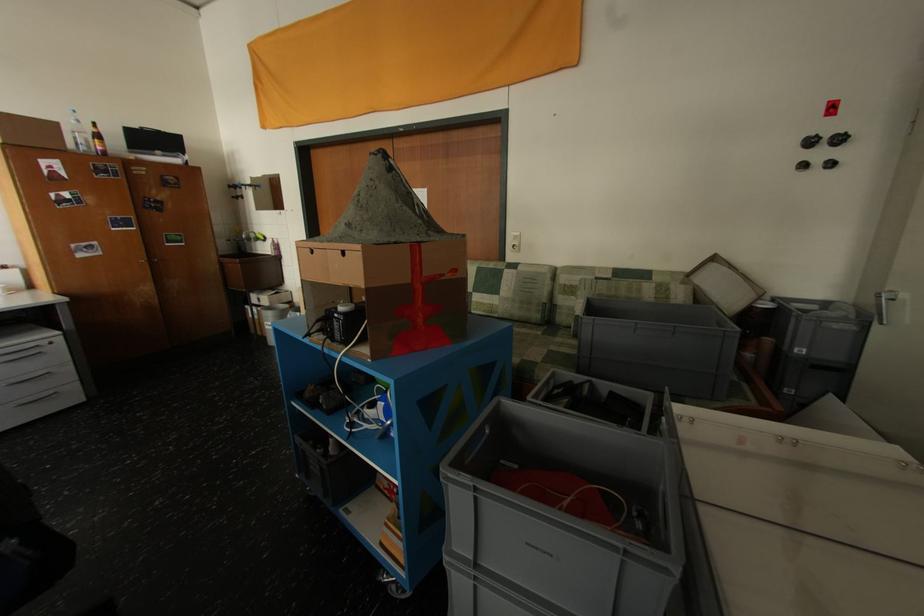
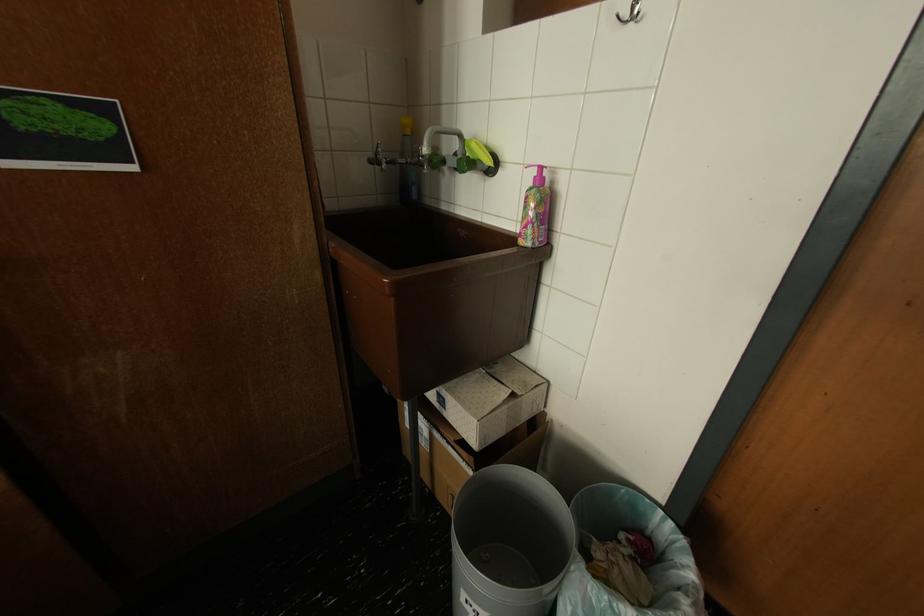
Where in the second image is the point corresponding to pixel 237 241 from the first image?

(379, 163)